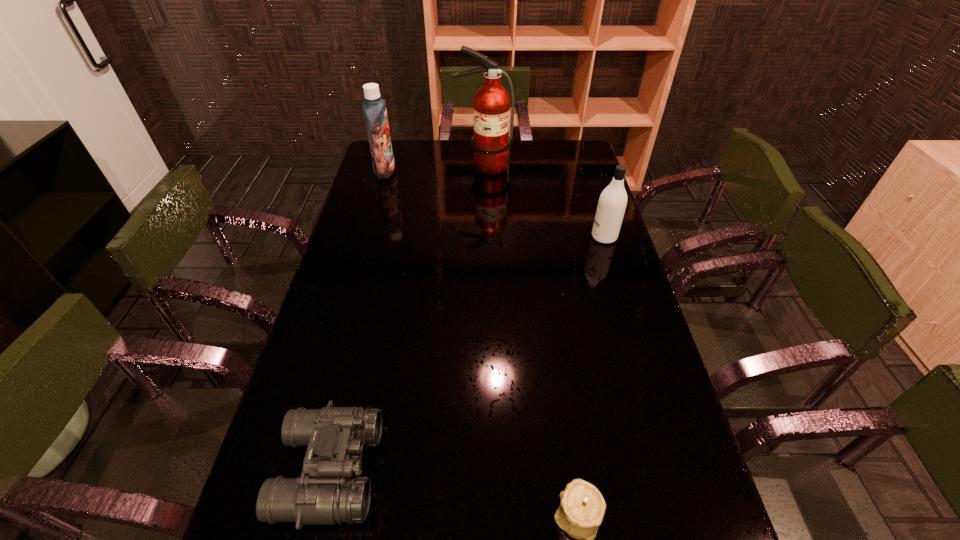
Identify the location of object that ranks as the closest to the binoculars. (582, 508).

Identify the location of free spot that satisfies the following two spatial constraints: 1. on the nozzle and handle of the fire extinguisher; 2. on the front label of the left shampoo. This screenshot has height=540, width=960. (483, 171).